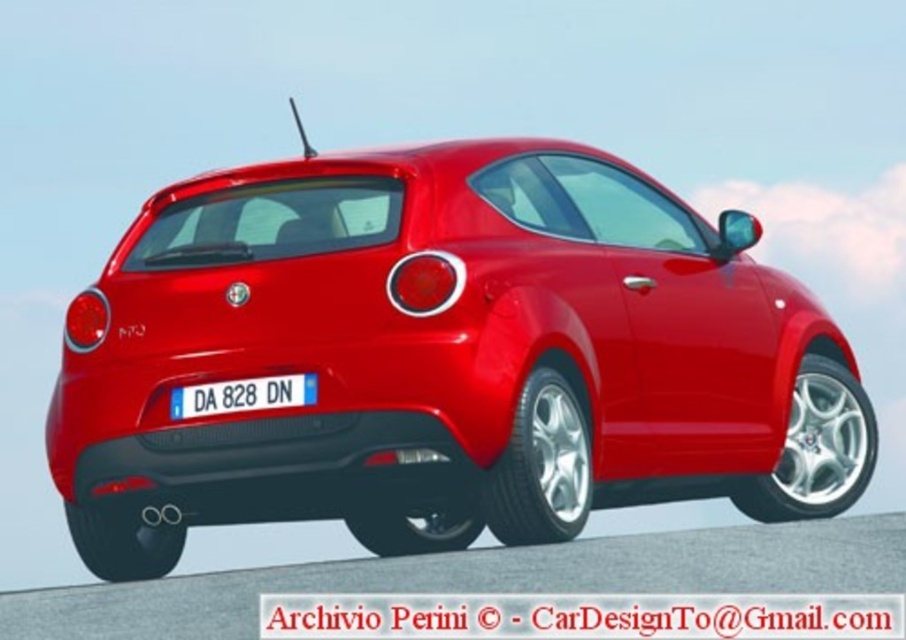
Question: Which object appears farthest from the camera in this image?

Choices:
 (A) white plastic license plate at center
 (B) glossy red car at center

Answer: (A)

Question: Among these objects, which one is farthest from the camera?

Choices:
 (A) glossy red car at center
 (B) white plastic license plate at center

Answer: (B)

Question: Does glossy red car at center have a larger size compared to white plastic license plate at center?

Choices:
 (A) no
 (B) yes

Answer: (B)

Question: Is glossy red car at center positioned behind white plastic license plate at center?

Choices:
 (A) yes
 (B) no

Answer: (B)

Question: Does glossy red car at center appear on the left side of white plastic license plate at center?

Choices:
 (A) yes
 (B) no

Answer: (B)

Question: Which of the following is the farthest from the observer?

Choices:
 (A) (124, 417)
 (B) (195, 397)

Answer: (A)